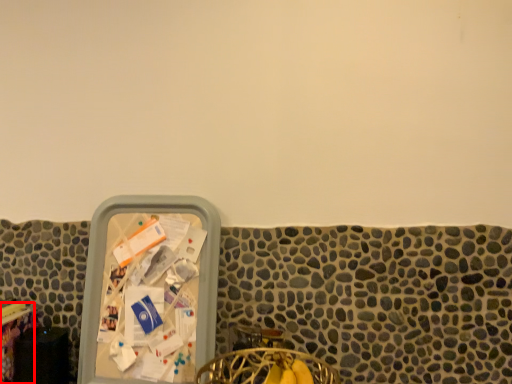
Question: From the image's perspective, what is the correct spatial positioning of table (annotated by the red box) in reference to chair?

Choices:
 (A) below
 (B) above

Answer: (B)